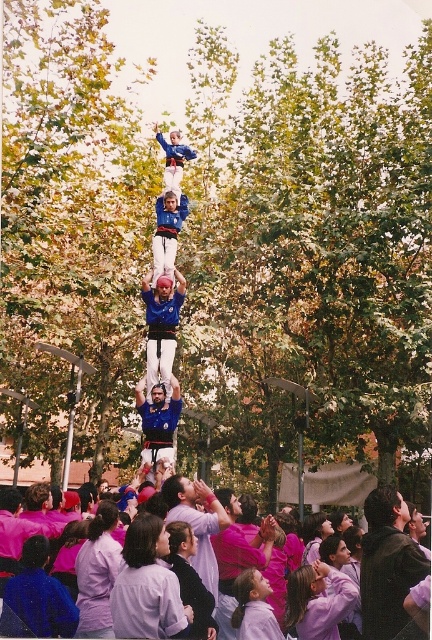
Is purple cotton shirt at center behind blue fabric shirt at center?

No, purple cotton shirt at center is closer to the viewer.

Is purple cotton shirt at center to the right of blue fabric shirt at center from the viewer's perspective?

Indeed, purple cotton shirt at center is positioned on the right side of blue fabric shirt at center.

Locate an element on the screen. The height and width of the screenshot is (640, 432). purple cotton shirt at center is located at coordinates (196, 522).

Does dark brown leather jacket at center have a lesser width compared to pink fabric crowd at lower center?

Yes, dark brown leather jacket at center is thinner than pink fabric crowd at lower center.

Who is shorter, dark brown leather jacket at center or pink fabric crowd at lower center?

Standing shorter between the two is dark brown leather jacket at center.

Between point (387, 497) and point (375, 506), which one is positioned behind?

The point (387, 497) is behind.

The width and height of the screenshot is (432, 640). I want to click on dark brown leather jacket at center, so click(387, 564).

Does point (270, 609) come closer to viewer compared to point (384, 497)?

That is True.

This screenshot has height=640, width=432. What do you see at coordinates (254, 608) in the screenshot? I see `purple fabric shirt at center` at bounding box center [254, 608].

Where is `purple fabric shirt at center`? This screenshot has height=640, width=432. purple fabric shirt at center is located at coordinates (254, 608).